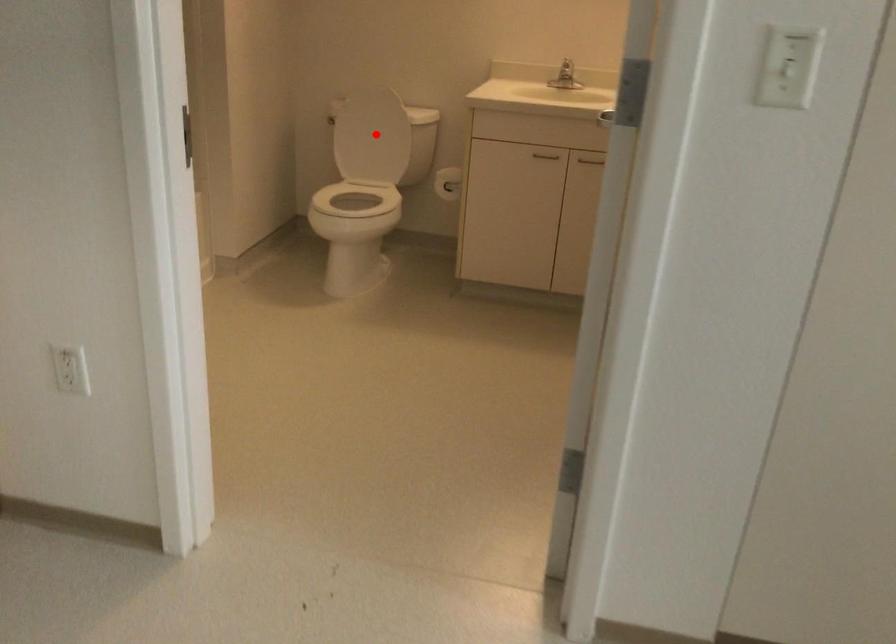
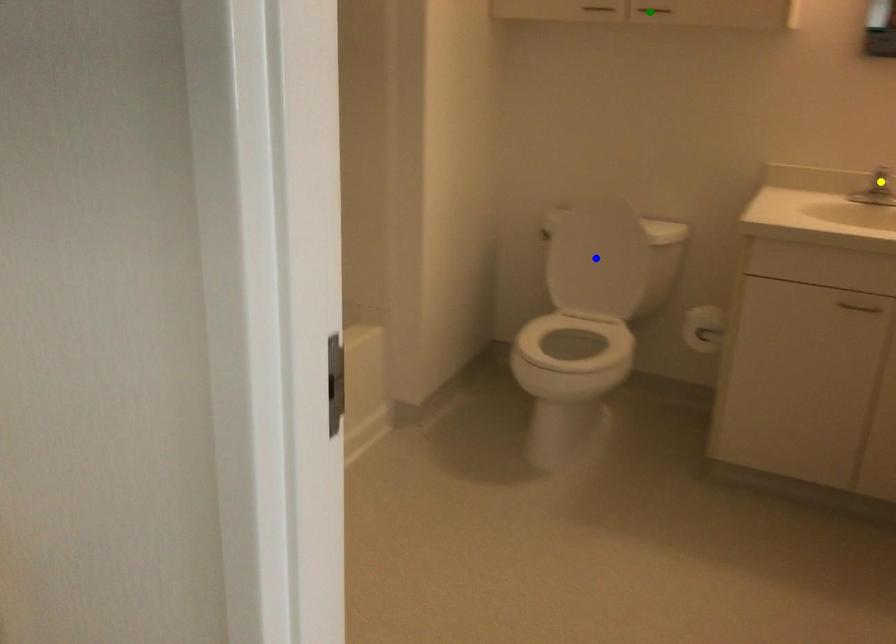
Question: I am providing you with two images of the same scene from different viewpoints. A red point is marked on the first image. You are given multiple points on the second image. In image 2, which mark is for the same physical point as the one in image 1?

Choices:
 (A) yellow point
 (B) green point
 (C) blue point

Answer: (C)